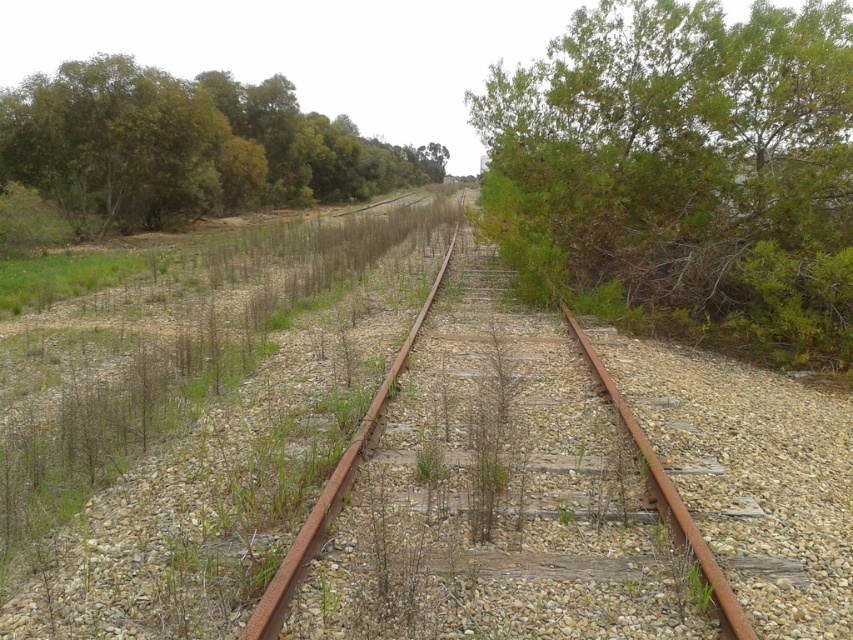
Based on the photo, you are standing on the abandoned railway track and notice the rusty metal track at center and the green leafy tree at upper left. Which object is positioned to the right of the other?

The rusty metal track at center is to the right of the green leafy tree at upper left according to the description.

You are standing at the starting point of the abandoned railway track. You notice a green leafy bush at right. Based on its coordinates, is the bush closer to the beginning or the end of the track?

The green leafy bush at right is located at point (x=683, y=173), which is closer to the end of the track since the coordinates suggest it is positioned further along the track.